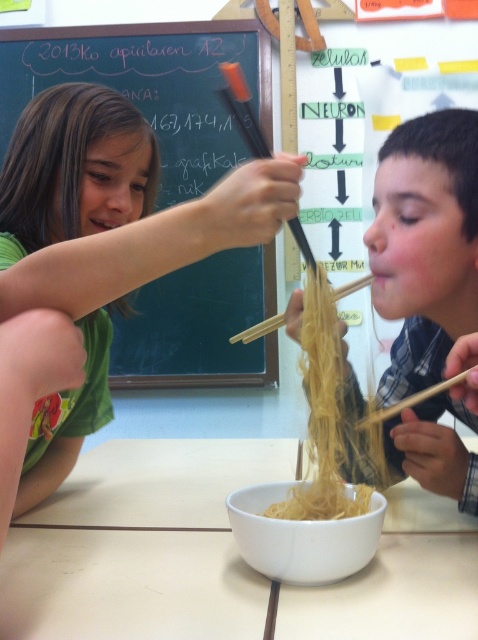
Question: Does yellow matte noodles at center have a greater width compared to yellow matte spaghetti at center?

Choices:
 (A) yes
 (B) no

Answer: (A)

Question: Which object appears farthest from the camera in this image?

Choices:
 (A) smooth wood chopstick at center
 (B) white matte bowl at center
 (C) yellow matte spaghetti at center

Answer: (A)

Question: Is wooden chopstick at right wider than smooth wood chopstick at center?

Choices:
 (A) no
 (B) yes

Answer: (A)

Question: Which point is farther from the camera taking this photo?

Choices:
 (A) (337, 560)
 (B) (165, 164)
 (C) (369, 275)
 (D) (323, 416)

Answer: (B)

Question: From the image, what is the correct spatial relationship of yellow matte noodles at center in relation to smooth wood chopstick at center?

Choices:
 (A) right
 (B) left

Answer: (A)

Question: Which of the following is the closest to the observer?

Choices:
 (A) (299, 561)
 (B) (249, 336)
 (C) (289, 314)
 (D) (315, 483)

Answer: (A)